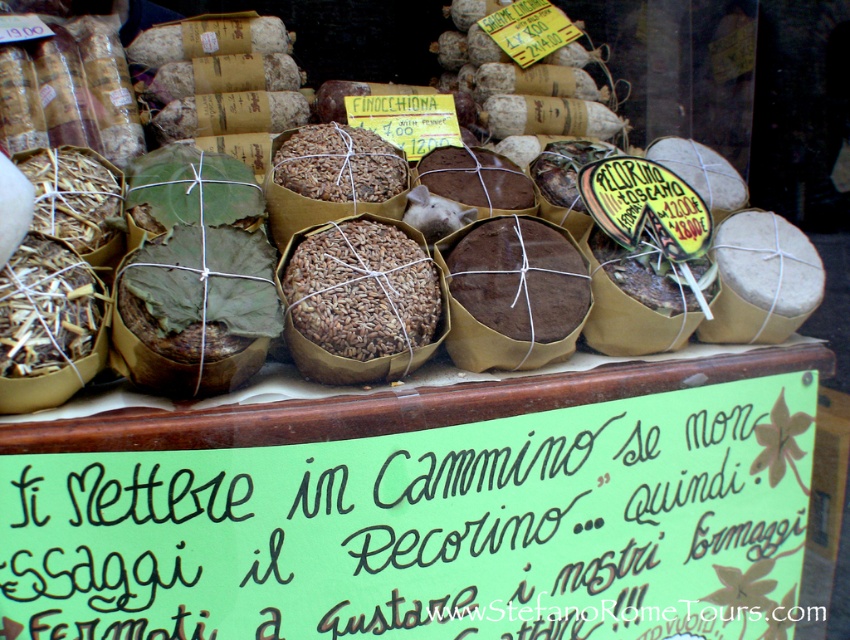
Question: Is brown paper wrapped cheese at center below brown textured grain at center?

Choices:
 (A) no
 (B) yes

Answer: (A)

Question: Which is farther from the brown textured grain at center?

Choices:
 (A) green paper sign at lower center
 (B) brown textured bread at center
 (C) brown paper wrapped cheese at center

Answer: (C)

Question: Is green paper sign at lower center wider than brown textured bread at center?

Choices:
 (A) yes
 (B) no

Answer: (A)

Question: Among these points, which one is farthest from the camera?

Choices:
 (A) (608, 504)
 (B) (355, 275)
 (C) (842, 342)

Answer: (C)

Question: Does brown paper wrapped cheese at center appear over brown textured grain at center?

Choices:
 (A) yes
 (B) no

Answer: (A)

Question: Which object is positioned closest to the green paper sign at lower center?

Choices:
 (A) brown textured grain at center
 (B) brown paper wrapped cheese at center
 (C) brown textured bread at center

Answer: (C)